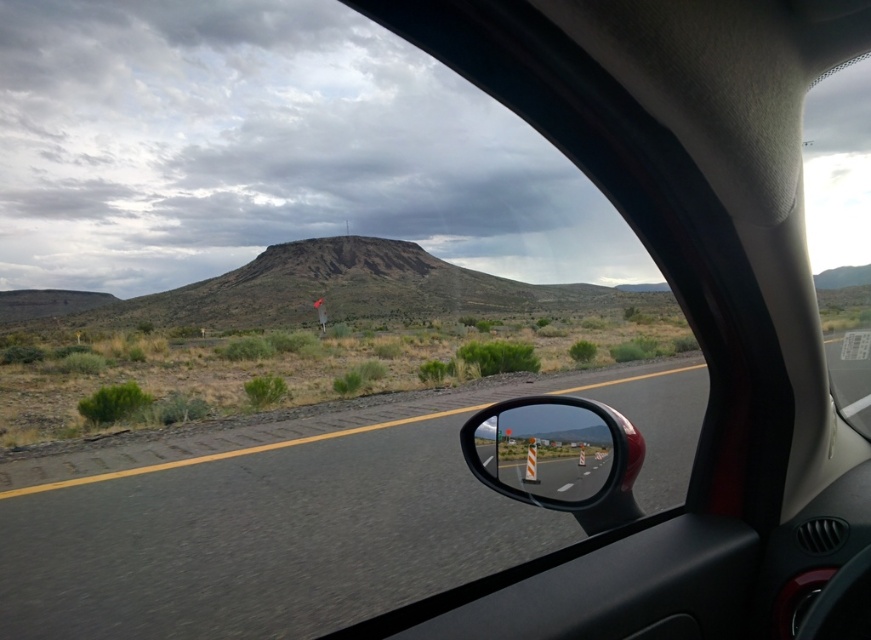
You are sitting in the passenger seat of a car and see a point on the road through the window. The point is located at coordinates point [329,566]. Given that the car is 16 feet long, can you determine if the point is within the car or outside on the road?

The point point [329,566] is 11.35 feet from the viewer, which is less than the car length of 16 feet. Therefore, the point is within the car.

You are a driver checking the road conditions. The asphalt road at center is narrow. Can you safely pass through the transparent glass car window at upper right? Please consider the width of both the road and the window.

The asphalt road at center is narrower than the transparent glass car window at upper right, so the road is too narrow to safely pass through the window. You should proceed with caution or choose an alternative route.

You are sitting in the passenger seat of the car and notice both the shiny chrome mirror at right and the transparent glass car window at upper right. Which object is closer to you, the observer?

The shiny chrome mirror at right is closer to you because it is positioned in front of the transparent glass car window at upper right, meaning it is nearer to your viewpoint.